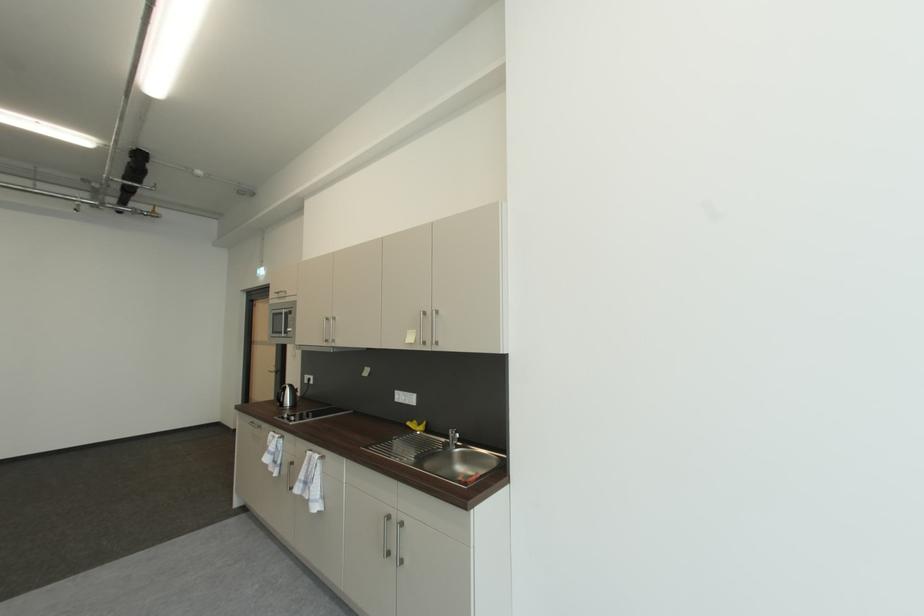
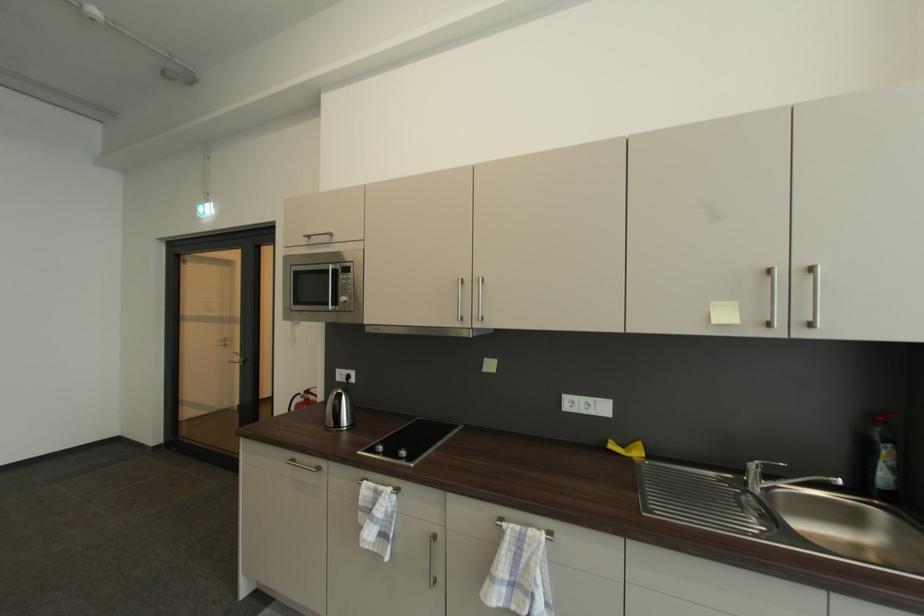
Locate, in the second image, the point that corresponds to [282,294] in the first image.

(311, 237)